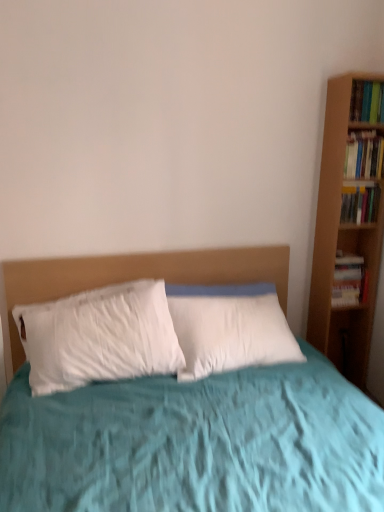
The height and width of the screenshot is (512, 384). What do you see at coordinates (367, 102) in the screenshot? I see `hardcover book at upper right, marked as the first book in a top-to-bottom arrangement` at bounding box center [367, 102].

In order to click on hardcover book at upper right, marked as the first book in a top-to-bottom arrangement in this screenshot , I will do `click(367, 102)`.

This screenshot has width=384, height=512. Identify the location of hardcover book at upper right, marked as the first book in a top-to-bottom arrangement. tap(367, 102).

From the image's perspective, is hardcover book at upper right, marked as the first book in a top-to-bottom arrangement, located beneath hardcover book at right, which is the 3th book in top-to-bottom order?

No, from the image's perspective, hardcover book at upper right, marked as the first book in a top-to-bottom arrangement, is not below hardcover book at right, which is the 3th book in top-to-bottom order.

Does hardcover book at upper right, marked as the first book in a top-to-bottom arrangement, appear on the right side of hardcover book at right, which is the 3th book in top-to-bottom order?

Indeed, hardcover book at upper right, marked as the first book in a top-to-bottom arrangement, is positioned on the right side of hardcover book at right, which is the 3th book in top-to-bottom order.

Is hardcover book at upper right, marked as the first book in a top-to-bottom arrangement, spatially inside hardcover book at right, which is the second book in bottom-to-top order, or outside of it?

hardcover book at upper right, marked as the first book in a top-to-bottom arrangement, exists outside the volume of hardcover book at right, which is the second book in bottom-to-top order.

Consider the image. From a real-world perspective, which is physically below, hardcover book at upper right, placed as the fourth book when sorted from bottom to top, or hardcover book at right, which is the second book in bottom-to-top order?

In real-world perspective, hardcover book at right, which is the second book in bottom-to-top order, is lower.

From a real-world perspective, count 3rd books upward from the hardcover book at right, which appears as the first book when ordered from the bottom, and point to it. Please provide its 2D coordinates.

[(367, 102)]

Considering the relative sizes of hardcover book at right, arranged as the fourth book when viewed from the top, and hardcover book at upper right, marked as the first book in a top-to-bottom arrangement, in the image provided, is hardcover book at right, arranged as the fourth book when viewed from the top, smaller than hardcover book at upper right, marked as the first book in a top-to-bottom arrangement,?

Actually, hardcover book at right, arranged as the fourth book when viewed from the top, might be larger than hardcover book at upper right, marked as the first book in a top-to-bottom arrangement.

Looking at their sizes, would you say hardcover book at right, which appears as the first book when ordered from the bottom, is wider or thinner than hardcover book at upper right, placed as the fourth book when sorted from bottom to top?

Considering their sizes, hardcover book at right, which appears as the first book when ordered from the bottom, looks broader than hardcover book at upper right, placed as the fourth book when sorted from bottom to top.

Is hardcover book at right, arranged as the fourth book when viewed from the top, beside hardcover book at upper right, marked as the first book in a top-to-bottom arrangement?

No, hardcover book at right, arranged as the fourth book when viewed from the top, is not beside hardcover book at upper right, marked as the first book in a top-to-bottom arrangement.

Which of these two, hardcover book at right, which is the 3th book in top-to-bottom order, or hardcover book at right, which appears as the first book when ordered from the bottom, stands shorter?

hardcover book at right, which is the 3th book in top-to-bottom order.

Is hardcover book at right, which is the 3th book in top-to-bottom order, not close to hardcover book at right, arranged as the fourth book when viewed from the top?

No, there isn't a large distance between hardcover book at right, which is the 3th book in top-to-bottom order, and hardcover book at right, arranged as the fourth book when viewed from the top.

Is hardcover book at right, which is the 3th book in top-to-bottom order, aimed at hardcover book at right, which appears as the first book when ordered from the bottom?

No, hardcover book at right, which is the 3th book in top-to-bottom order, is not turned towards hardcover book at right, which appears as the first book when ordered from the bottom.

From the image's perspective, would you say hardcover book at right, which appears as the first book when ordered from the bottom, is positioned over hardcover book at right, which is the second book in bottom-to-top order?

No, from the image's perspective, hardcover book at right, which appears as the first book when ordered from the bottom, is not over hardcover book at right, which is the second book in bottom-to-top order.

Is hardcover book at right, which appears as the first book when ordered from the bottom, oriented towards hardcover book at right, which is the second book in bottom-to-top order?

No, hardcover book at right, which appears as the first book when ordered from the bottom, does not turn towards hardcover book at right, which is the second book in bottom-to-top order.

Starting from the hardcover book at right, which appears as the first book when ordered from the bottom, which book is the 1st one in front? Please provide its 2D coordinates.

[(360, 204)]

From the picture: From a real-world perspective, which is physically above, hardcover book at right, the third book ordered from the bottom, or hardcover book at right, which appears as the first book when ordered from the bottom?

hardcover book at right, the third book ordered from the bottom, is physically above.

Which of these two, hardcover book at right, the third book ordered from the bottom, or hardcover book at right, arranged as the fourth book when viewed from the top, is smaller?

hardcover book at right, the third book ordered from the bottom.

Is hardcover book at right, arranged as the 2th book when viewed from the top, at the right side of hardcover book at right, arranged as the fourth book when viewed from the top?

Indeed, hardcover book at right, arranged as the 2th book when viewed from the top, is positioned on the right side of hardcover book at right, arranged as the fourth book when viewed from the top.

Does hardcover book at right, arranged as the 2th book when viewed from the top, have a lesser width compared to hardcover book at right, arranged as the fourth book when viewed from the top?

Yes.

Where is `the 1st book behind the hardcover book at right, the third book ordered from the bottom`? the 1st book behind the hardcover book at right, the third book ordered from the bottom is located at coordinates (360, 204).

Considering the relative sizes of hardcover book at right, the third book ordered from the bottom, and hardcover book at right, which is the 3th book in top-to-bottom order, in the image provided, is hardcover book at right, the third book ordered from the bottom, wider than hardcover book at right, which is the 3th book in top-to-bottom order,?

Correct, the width of hardcover book at right, the third book ordered from the bottom, exceeds that of hardcover book at right, which is the 3th book in top-to-bottom order.

From the image's perspective, which one is positioned higher, hardcover book at right, the third book ordered from the bottom, or hardcover book at right, which is the 3th book in top-to-bottom order?

hardcover book at right, the third book ordered from the bottom.

Is hardcover book at right, arranged as the 2th book when viewed from the top, outside of hardcover book at right, which is the 3th book in top-to-bottom order?

Yes, hardcover book at right, arranged as the 2th book when viewed from the top, is located beyond the bounds of hardcover book at right, which is the 3th book in top-to-bottom order.

Between hardcover book at upper right, placed as the fourth book when sorted from bottom to top, and hardcover book at right, which appears as the first book when ordered from the bottom, which one has smaller width?

Thinner between the two is hardcover book at upper right, placed as the fourth book when sorted from bottom to top.

How different are the orientations of hardcover book at upper right, marked as the first book in a top-to-bottom arrangement, and hardcover book at right, arranged as the fourth book when viewed from the top, in degrees?

The facing directions of hardcover book at upper right, marked as the first book in a top-to-bottom arrangement, and hardcover book at right, arranged as the fourth book when viewed from the top, are 0.894 degrees apart.

Which book is the 3rd one when counting from the left side of the hardcover book at upper right, placed as the fourth book when sorted from bottom to top? Please provide its 2D coordinates.

[(349, 280)]

Looking at this image, between hardcover book at upper right, marked as the first book in a top-to-bottom arrangement, and hardcover book at right, arranged as the fourth book when viewed from the top, which one has larger size?

With larger size is hardcover book at right, arranged as the fourth book when viewed from the top.

Find the location of a particular element. the 2nd book directly beneath the hardcover book at upper right, placed as the fourth book when sorted from bottom to top (from a real-world perspective) is located at coordinates (360, 204).

The height and width of the screenshot is (512, 384). In order to click on the 3rd book to the left of the hardcover book at upper right, marked as the first book in a top-to-bottom arrangement, starting your count from the anchor in this screenshot , I will do `click(349, 280)`.

Estimate the real-world distances between objects in this image. Which object is closer to hardcover book at right, arranged as the 2th book when viewed from the top, hardcover book at right, which is the second book in bottom-to-top order, or hardcover book at right, which appears as the first book when ordered from the bottom?

hardcover book at right, which is the second book in bottom-to-top order.

From the image, which object appears to be farther from hardcover book at right, the third book ordered from the bottom, hardcover book at right, which appears as the first book when ordered from the bottom, or hardcover book at upper right, placed as the fourth book when sorted from bottom to top?

hardcover book at right, which appears as the first book when ordered from the bottom, is further to hardcover book at right, the third book ordered from the bottom.

Estimate the real-world distances between objects in this image. Which object is further from hardcover book at right, the third book ordered from the bottom, hardcover book at right, which is the second book in bottom-to-top order, or hardcover book at upper right, placed as the fourth book when sorted from bottom to top?

hardcover book at upper right, placed as the fourth book when sorted from bottom to top.

In the scene shown: When comparing their distances from hardcover book at right, arranged as the 2th book when viewed from the top, does hardcover book at right, arranged as the fourth book when viewed from the top, or hardcover book at right, which is the second book in bottom-to-top order, seem closer?

The object closer to hardcover book at right, arranged as the 2th book when viewed from the top, is hardcover book at right, which is the second book in bottom-to-top order.

Considering their positions, is hardcover book at right, which is the second book in bottom-to-top order, positioned further to hardcover book at upper right, marked as the first book in a top-to-bottom arrangement, than hardcover book at right, arranged as the 2th book when viewed from the top?

hardcover book at right, which is the second book in bottom-to-top order, is positioned further to the anchor hardcover book at upper right, marked as the first book in a top-to-bottom arrangement.

When comparing their distances from hardcover book at right, arranged as the fourth book when viewed from the top, does hardcover book at right, which is the 3th book in top-to-bottom order, or hardcover book at right, the third book ordered from the bottom, seem closer?

hardcover book at right, which is the 3th book in top-to-bottom order.

Based on their spatial positions, is hardcover book at right, arranged as the fourth book when viewed from the top, or hardcover book at right, the third book ordered from the bottom, closer to hardcover book at upper right, marked as the first book in a top-to-bottom arrangement?

hardcover book at right, the third book ordered from the bottom, is closer to hardcover book at upper right, marked as the first book in a top-to-bottom arrangement.

Which object lies further to the anchor point hardcover book at right, which is the 3th book in top-to-bottom order, hardcover book at right, arranged as the 2th book when viewed from the top, or hardcover book at upper right, marked as the first book in a top-to-bottom arrangement?

hardcover book at upper right, marked as the first book in a top-to-bottom arrangement, is further to hardcover book at right, which is the 3th book in top-to-bottom order.

The width and height of the screenshot is (384, 512). I want to click on book that lies between hardcover book at upper right, marked as the first book in a top-to-bottom arrangement, and hardcover book at right, which is the 3th book in top-to-bottom order, from top to bottom, so click(x=364, y=155).

This screenshot has height=512, width=384. Identify the location of book that lies between hardcover book at right, arranged as the 2th book when viewed from the top, and hardcover book at right, which appears as the first book when ordered from the bottom, from top to bottom. (360, 204).